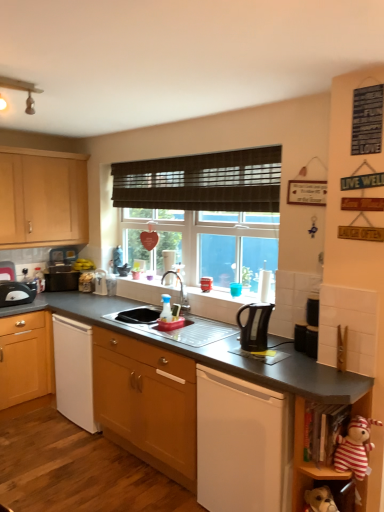
I want to click on free space to the left of black plastic kettle at center, marked as the 1th kitchen appliance in a right-to-left arrangement, so click(228, 349).